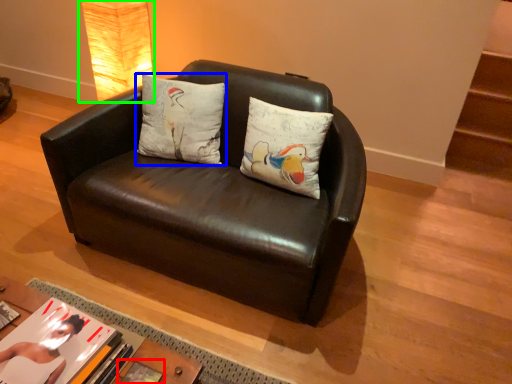
Question: Which object is the farthest from book (highlighted by a red box)? Choose among these: pillow (highlighted by a blue box) or lamp (highlighted by a green box).

Choices:
 (A) pillow
 (B) lamp

Answer: (B)